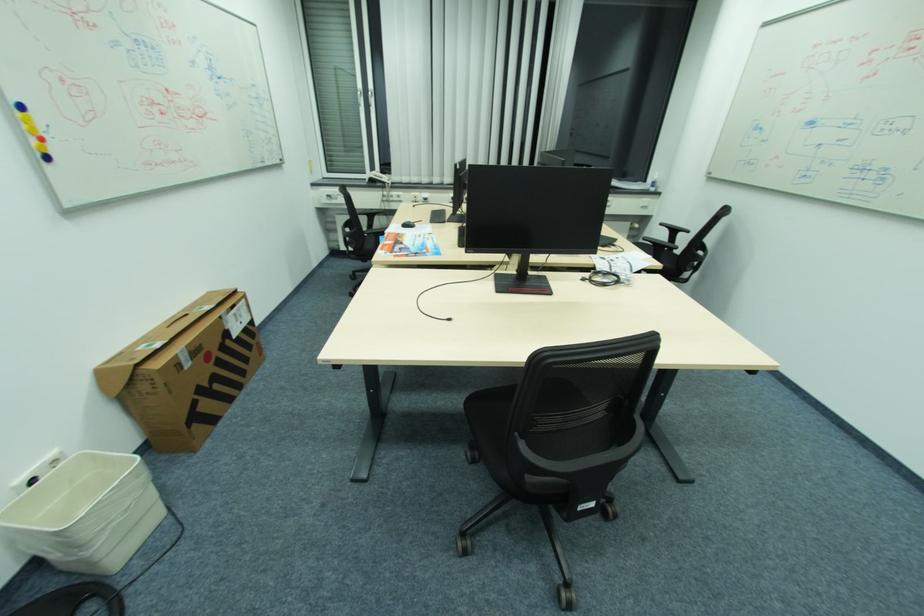
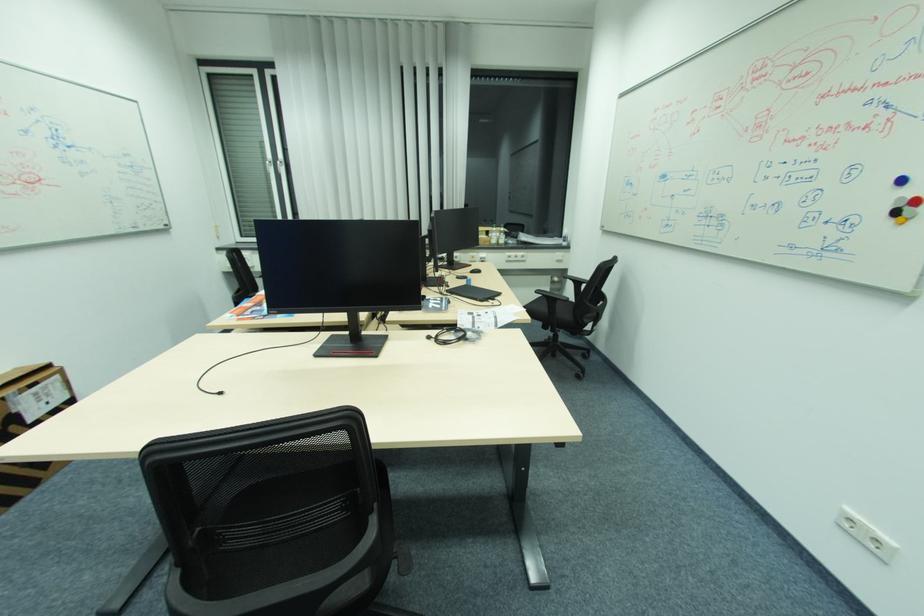
Question: I am providing you with two images of the same scene from different viewpoints. After the viewpoint changes to image2, which objects are now occluded?

Choices:
 (A) computer mouse
 (B) black coiled cable
 (C) black chair armrest
 (D) red display button

Answer: (A)